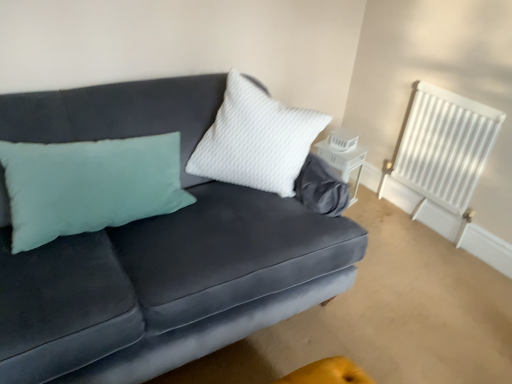
Find the location of a particular element. The image size is (512, 384). vacant area in front of white painted metal radiator at upper right is located at coordinates (432, 255).